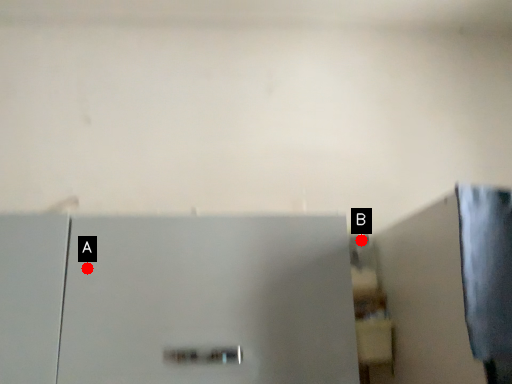
Question: Two points are circled on the image, labeled by A and B beside each circle. Which of the following is the closest to the observer?

Choices:
 (A) A is closer
 (B) B is closer

Answer: (A)